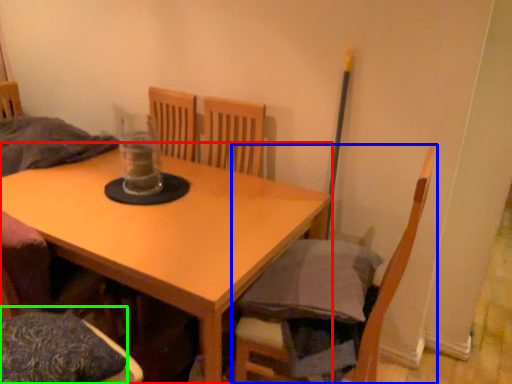
Question: Based on their relative distances, which object is farther from table (highlighted by a red box)? Choose from chair (highlighted by a blue box) and pillow (highlighted by a green box).

Choices:
 (A) chair
 (B) pillow

Answer: (A)